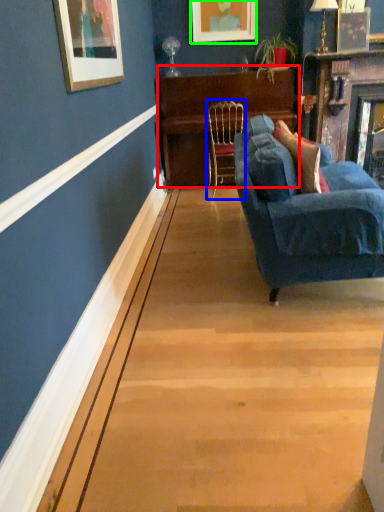
Question: Estimate the real-world distances between objects in this image. Which object is closer to table (highlighted by a red box), chair (highlighted by a blue box) or picture frame (highlighted by a green box)?

Choices:
 (A) chair
 (B) picture frame

Answer: (A)